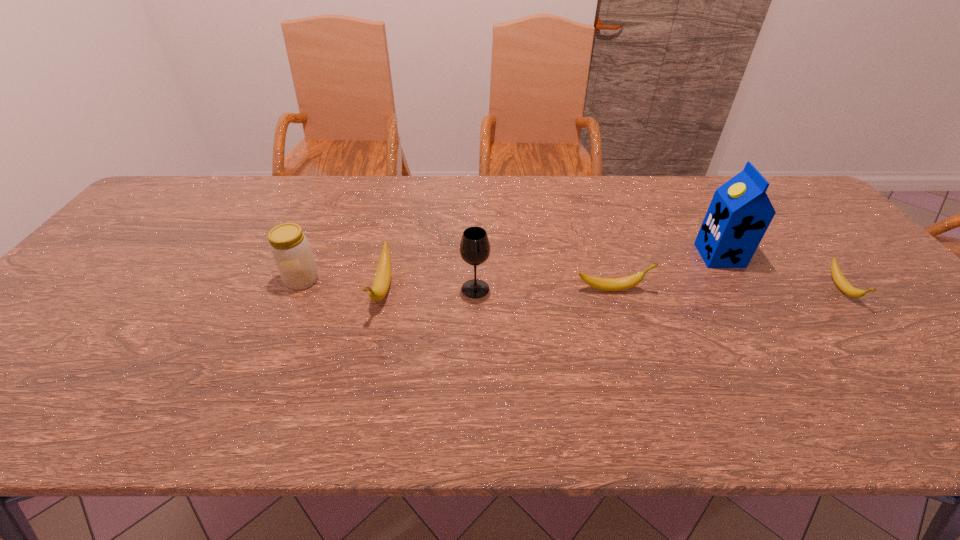
Locate an element on the screen. The width and height of the screenshot is (960, 540). vacant place for an extra banana on the left is located at coordinates tap(154, 288).